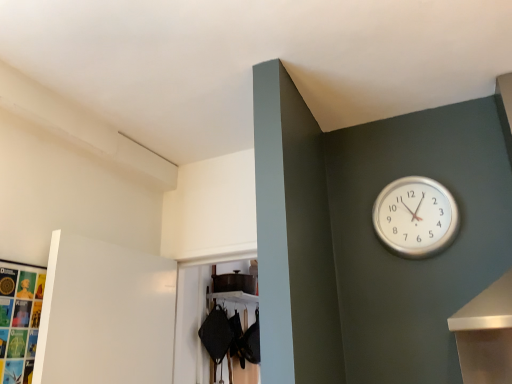
What is the approximate width of silver metallic clock at upper right?

silver metallic clock at upper right is 4.98 inches wide.

The image size is (512, 384). What do you see at coordinates (415, 217) in the screenshot?
I see `silver metallic clock at upper right` at bounding box center [415, 217].

The height and width of the screenshot is (384, 512). I want to click on silver metallic clock at upper right, so click(x=415, y=217).

Identify the location of silver metallic clock at upper right. This screenshot has width=512, height=384. (415, 217).